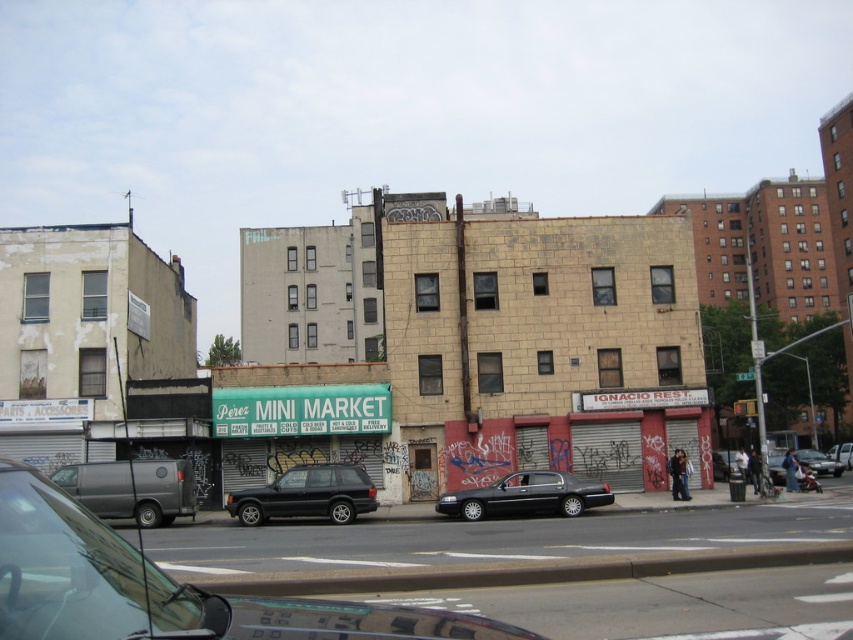
From the picture: You are a delivery person needing to park your shiny black suv at center in this urban area. Given that the parking spot is at coordinates 0.773, 0.361, is your vehicle currently positioned correctly for parking?

The shiny black suv at center is already positioned at the coordinates [306,493], so it is correctly placed for parking.

You are a delivery person needing to park your 2.5 meter wide van between the black metallic sedan at center and the silver metallic suv at center. Can you fit your van there?

The black metallic sedan at center is narrower than the silver metallic suv at center. However, since the sedan is only narrower by an unspecified amount, it is uncertain whether there is enough space between them for your 2.5 meter wide van. You should measure the gap before deciding.

You are a delivery driver who needs to park your shiny black suv at center. The parking spot is located at point (306, 493). Can you safely park your vehicle there?

The point (306, 493) indicates the location of the shiny black suv at center, so you cannot park there as the vehicle is already occupying that spot.